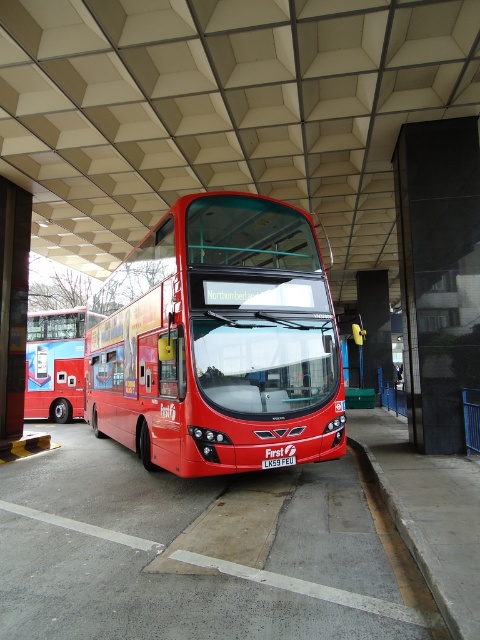
You are standing at the bus station and need to determine the relative positions of two points on the roof structure. Which point is closer to you, point (300, 228) or point (75, 328)?

Point (300, 228) is closer to the viewer than point (75, 328).

You are a bus driver who just arrived at the terminal. You need to park your shiny red bus at center so it doesn not block the matte red bus at center. According to the scene, where should you park your bus?

The shiny red bus at center is below the matte red bus at center. To avoid blocking it, you should park the shiny red bus at center in a position that is lower than the matte red bus at center.

You are a bus driver who needs to park your shiny red bus at center in a space designed for the matte red bus at center. Will your bus fit in the designated space?

The shiny red bus at center is smaller than the matte red bus at center, so it should fit comfortably in the space designed for the larger matte red bus at center.